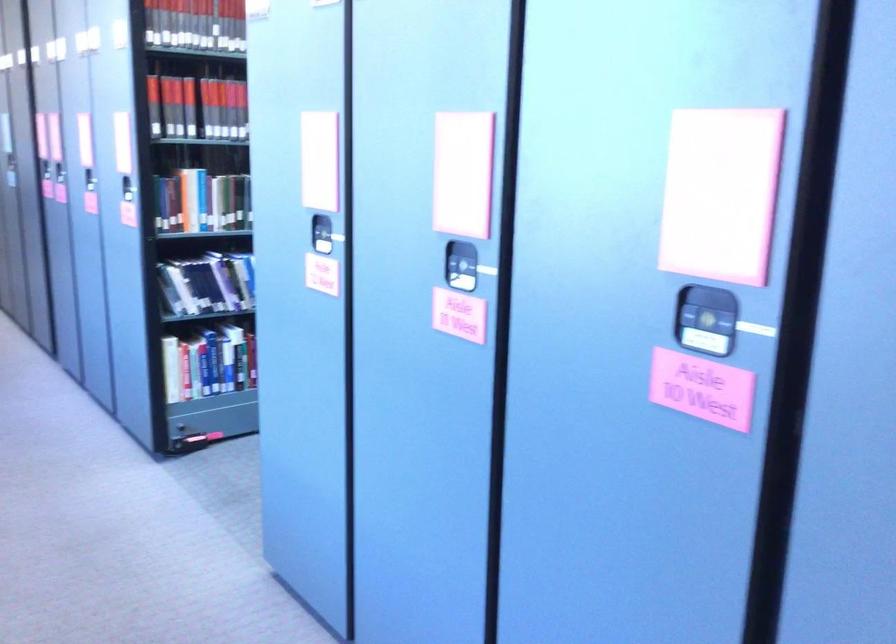
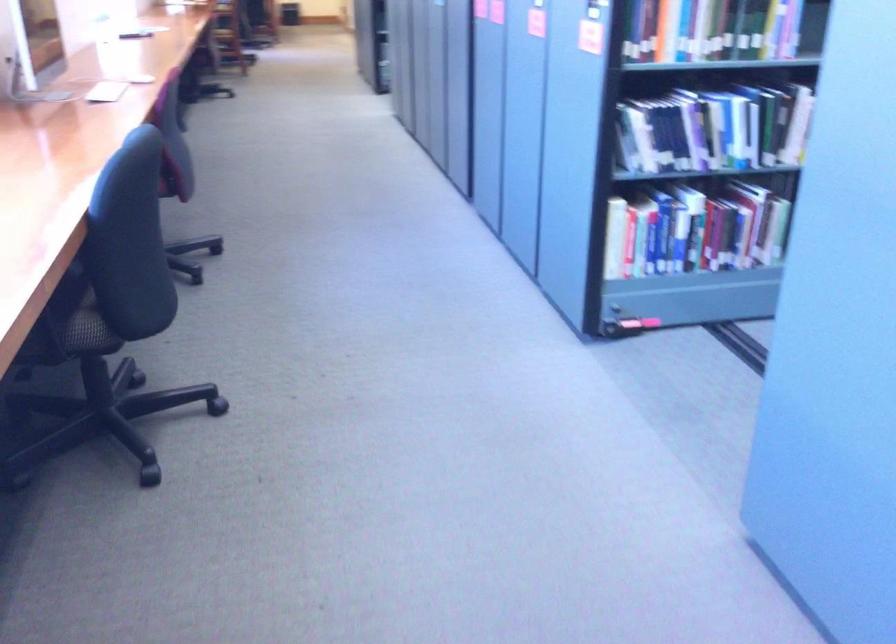
Which direction would the cameraman need to move to produce the second image?

The movement direction of the cameraman is left, forward.